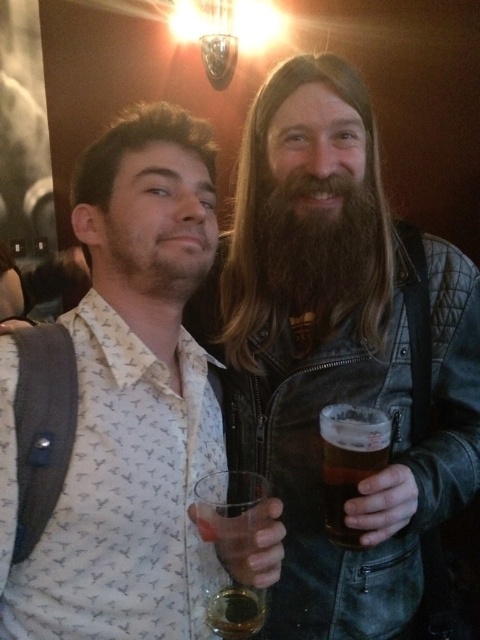
Question: Which point is farther to the camera?

Choices:
 (A) (93, 262)
 (B) (446, 356)

Answer: (B)

Question: Can you confirm if translucent glass at lower center is smaller than brown matte glass at right?

Choices:
 (A) yes
 (B) no

Answer: (B)

Question: In this image, where is leather jacket at center located relative to brown fuzzy beard at center?

Choices:
 (A) below
 (B) above

Answer: (A)

Question: From the image, what is the correct spatial relationship of white printed shirt at center in relation to translucent glass at lower center?

Choices:
 (A) above
 (B) below

Answer: (A)

Question: Among these objects, which one is nearest to the camera?

Choices:
 (A) leather jacket at center
 (B) translucent glass at lower center

Answer: (B)

Question: Which of the following is the closest to the observer?

Choices:
 (A) translucent glass at lower center
 (B) leather jacket at center

Answer: (A)